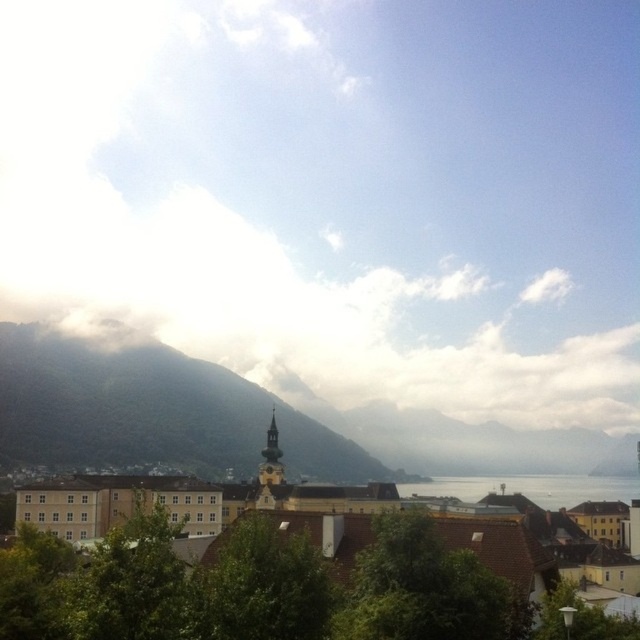
Question: Can you confirm if green textured mountain at center-left is smaller than transparent water at center?

Choices:
 (A) no
 (B) yes

Answer: (A)

Question: Which point is closer to the camera taking this photo?

Choices:
 (A) (163, 380)
 (B) (412, 364)

Answer: (A)

Question: In this image, where is white fluffy cloud at upper center located relative to yellow matte building at center?

Choices:
 (A) right
 (B) left

Answer: (B)

Question: Which point appears closest to the camera in this image?

Choices:
 (A) (200, 378)
 (B) (525, 358)

Answer: (A)

Question: Considering the relative positions of white fluffy cloud at upper center and green textured mountain at center-left in the image provided, where is white fluffy cloud at upper center located with respect to green textured mountain at center-left?

Choices:
 (A) below
 (B) above

Answer: (B)

Question: Which is farther from the white fluffy cloud at upper center?

Choices:
 (A) green textured mountain at center-left
 (B) yellow matte building at center

Answer: (B)